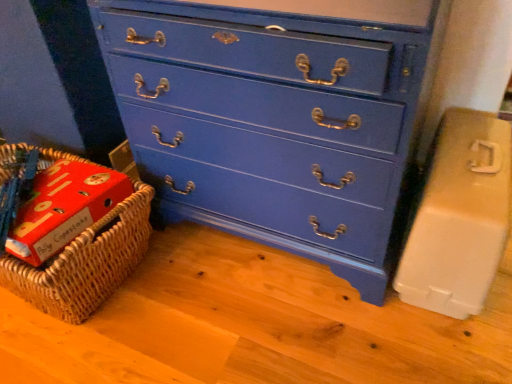
The image size is (512, 384). In order to click on vacant area that is in front of blue painted wood chest of drawers at center in this screenshot , I will do `click(281, 323)`.